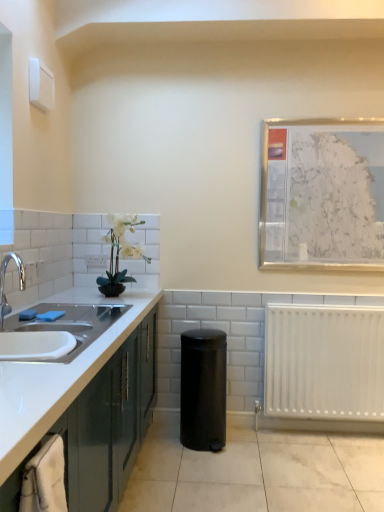
Identify the location of free spot above white plastic radiator at lower right (from a real-world perspective). Image resolution: width=384 pixels, height=512 pixels. (332, 303).